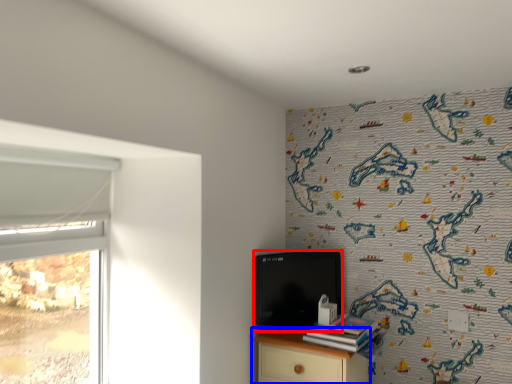
Question: Which object appears closest to the camera in this image, computer (highlighted by a red box) or nightstand (highlighted by a blue box)?

Choices:
 (A) computer
 (B) nightstand

Answer: (B)